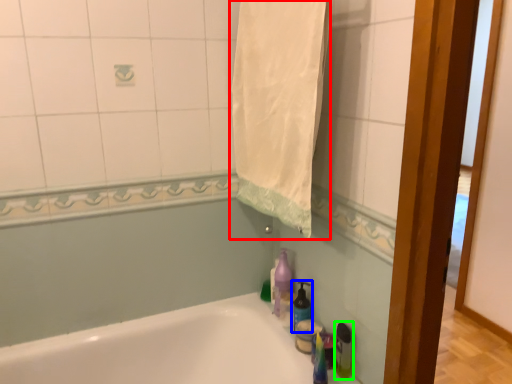
Question: Which is farther away from bath towel (highlighted by a red box)? soap dispenser (highlighted by a blue box) or bottle (highlighted by a green box)?

Choices:
 (A) soap dispenser
 (B) bottle

Answer: (B)